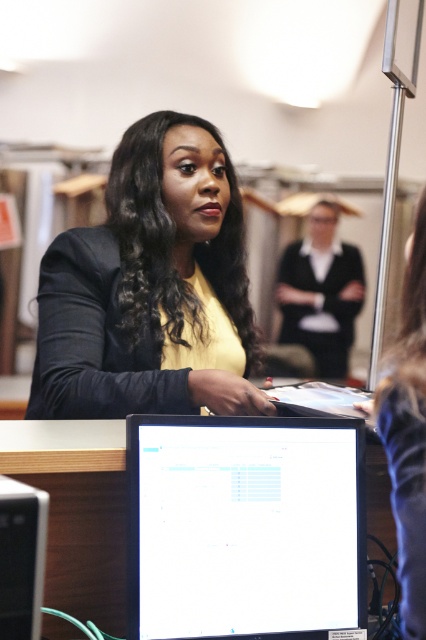
Question: Which point appears farthest from the camera in this image?

Choices:
 (A) (319, 312)
 (B) (14, 596)

Answer: (A)

Question: Estimate the real-world distances between objects in this image. Which object is farther from the smooth black hair at center?

Choices:
 (A) white glossy monitor at center
 (B) matte black jacket at center
 (C) black matte blazer at upper center

Answer: (C)

Question: Is smooth black hair at center wider than black matte blazer at upper center?

Choices:
 (A) yes
 (B) no

Answer: (B)

Question: Which of the following is the closest to the observer?

Choices:
 (A) black matte blazer at upper center
 (B) matte black jacket at center

Answer: (B)

Question: Can you confirm if matte black jacket at center is smaller than white glossy monitor at center?

Choices:
 (A) no
 (B) yes

Answer: (A)

Question: Does matte black jacket at center have a smaller size compared to white plastic computer tower at lower left?

Choices:
 (A) yes
 (B) no

Answer: (B)